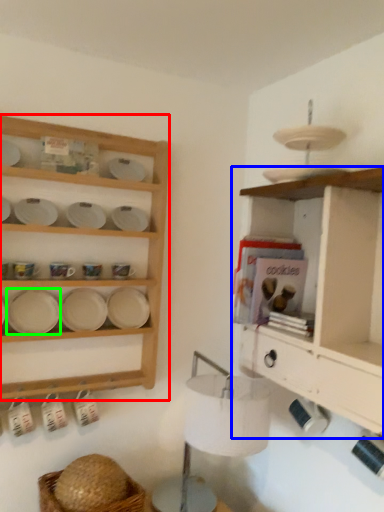
Question: Based on their relative distances, which object is nearer to shelf (highlighted by a red box)? Choose from shelf (highlighted by a blue box) and platter (highlighted by a green box).

Choices:
 (A) shelf
 (B) platter

Answer: (B)